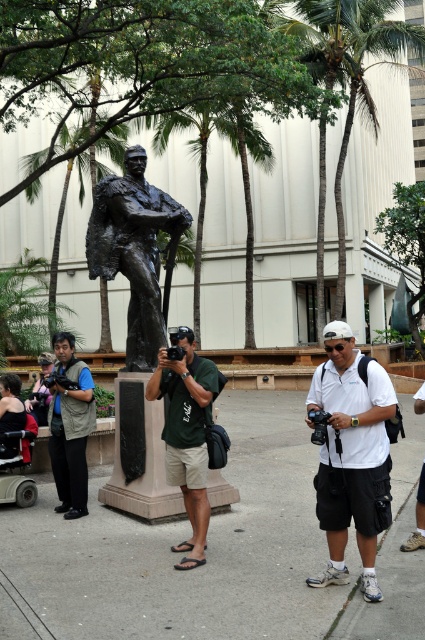
You are a photographer trying to capture a photo of the bronze statue while ensuring both the matte black vest at center and the red fabric wheelchair at lower left are visible in the frame. Given their distance apart, can you fit both into your camera viewfinder without moving either object?

The matte black vest at center and red fabric wheelchair at lower left are 25.82 inches apart. Since this distance is relatively small, it should be possible to frame both objects within the camera viewfinder without moving them.

You are standing at point (65, 508) and want to walk to the statue. Is there a clear path from your current position to the statue without passing through point (169, 436)?

Point (169, 436) is in front of point (65, 508), so there is an obstacle between you and the statue. You will need to go around it to reach the statue.

What is the color of the fabric shirt worn by the person standing at the coordinates point (187, 433) in the scene?

The point (187, 433) marks the green fabric shirt at center, so the color is green.